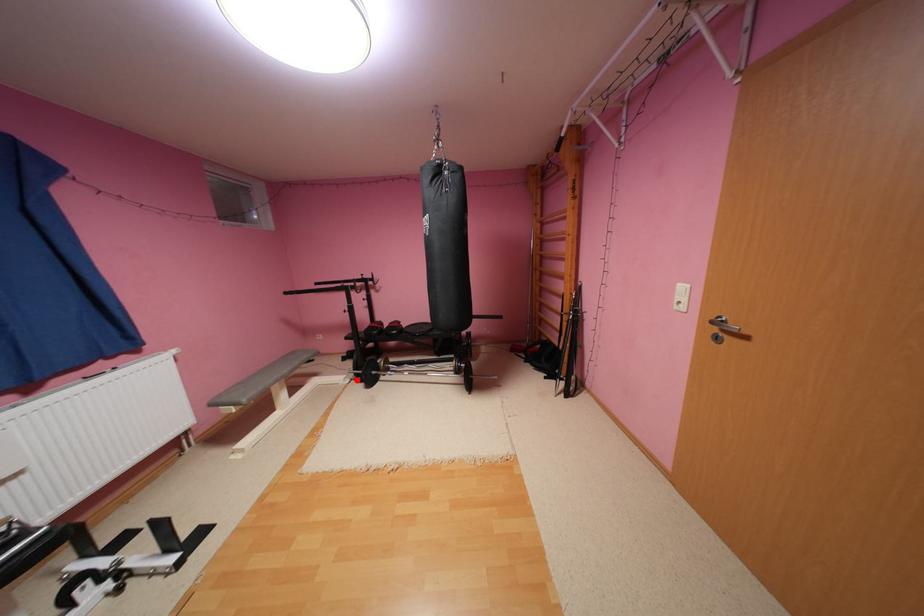
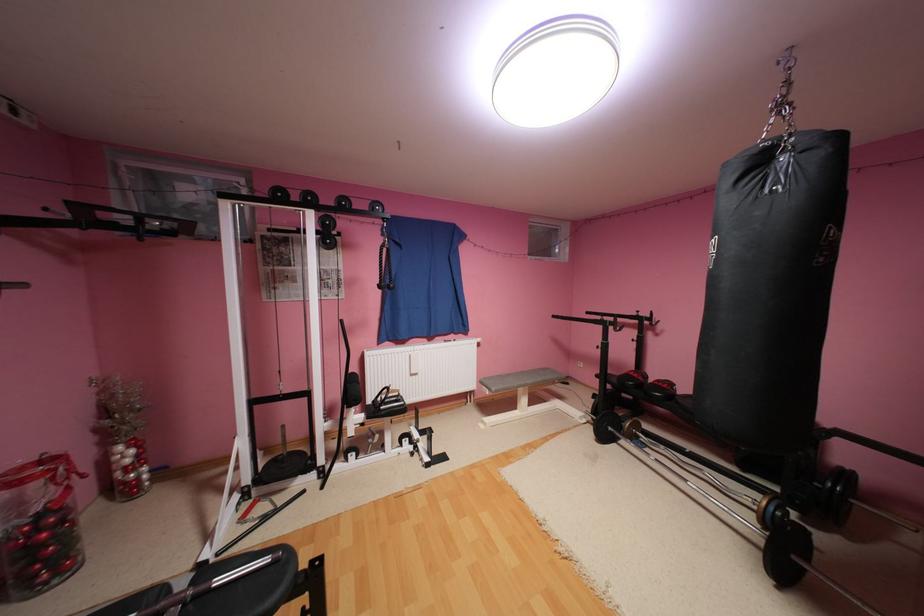
Question: I am providing you with two images of the same scene from different viewpoints. In image1, a red point is highlighted. Considering the same 3D point in image2, which of the following is correct?

Choices:
 (A) It is closer
 (B) It is farther

Answer: (A)